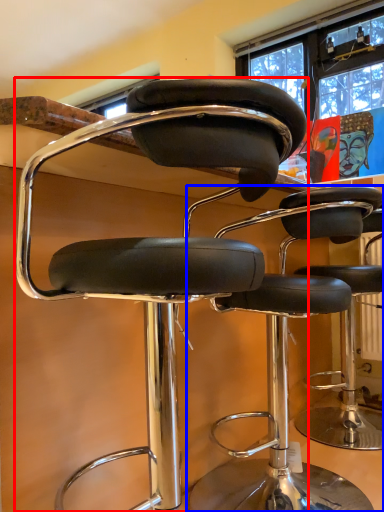
Question: Which object is further to the camera taking this photo, chair (highlighted by a red box) or chair (highlighted by a blue box)?

Choices:
 (A) chair
 (B) chair

Answer: (B)